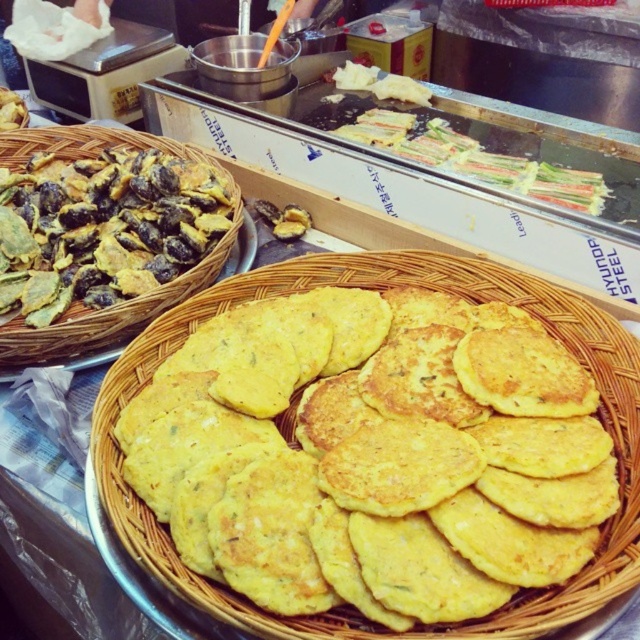
Does yellow matte pancake basket at center have a greater width compared to yellow crispy chips at left?

Correct, the width of yellow matte pancake basket at center exceeds that of yellow crispy chips at left.

Does point (524, 275) come in front of point (83, 296)?

That is True.

From the picture: Who is more forward, (369, 276) or (148, 198)?

Point (369, 276)

This screenshot has height=640, width=640. I want to click on yellow matte pancake basket at center, so pos(381,289).